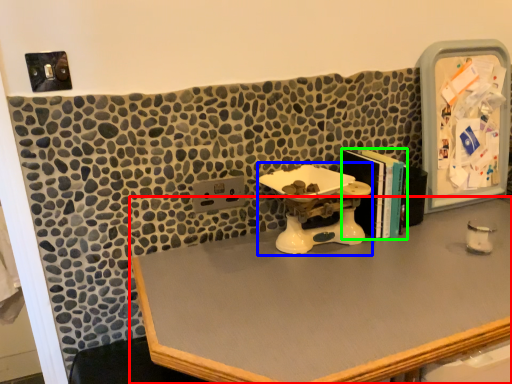
Question: Which is farther away from desk (highlighted by a red box)? sink (highlighted by a blue box) or book (highlighted by a green box)?

Choices:
 (A) sink
 (B) book

Answer: (B)